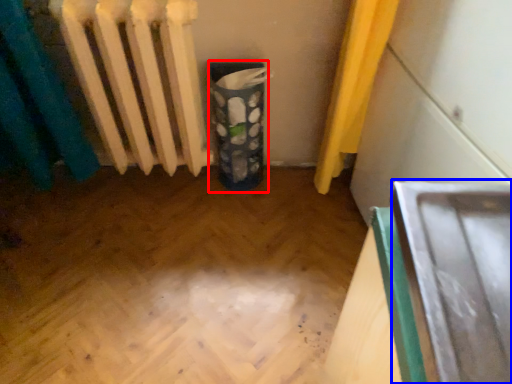
Question: Which object is further to the camera taking this photo, recycling bin (highlighted by a red box) or wide (highlighted by a blue box)?

Choices:
 (A) recycling bin
 (B) wide

Answer: (A)